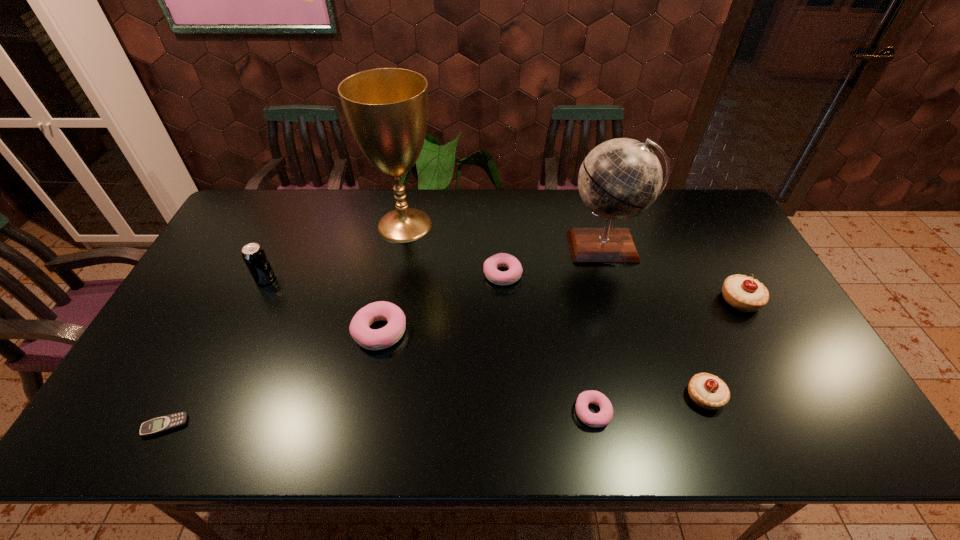
The image size is (960, 540). I want to click on the fifth object from right to left, so click(x=491, y=264).

Where is `the smallest pink pastry`? The height and width of the screenshot is (540, 960). the smallest pink pastry is located at coordinates (601, 419).

Where is `the shortest pastry`? the shortest pastry is located at coordinates (601, 419).

Find the location of a particular element. beeper is located at coordinates (166, 423).

Where is `gray beeper`? Image resolution: width=960 pixels, height=540 pixels. gray beeper is located at coordinates (166, 423).

You are a GUI agent. You are given a task and a screenshot of the screen. Output one action in this format:
    pyautogui.click(x=<x>, y=<y>)
    Task: Click on the vacant space positioned 0.330m on the right of the tallest object
    The width and height of the screenshot is (960, 540).
    Given the screenshot: What is the action you would take?
    pyautogui.click(x=536, y=225)

This screenshot has width=960, height=540. Find the location of `vacant space located at the equator of the eighth shortest object`. vacant space located at the equator of the eighth shortest object is located at coordinates (625, 315).

Identify the location of vacant position located 0.350m on the right of the soda can. (391, 279).

The height and width of the screenshot is (540, 960). In order to click on blank area located 0.210m on the left of the rightmost pastry in this screenshot , I will do `click(647, 300)`.

Locate an element on the screen. The width and height of the screenshot is (960, 540). free spot located 0.350m on the left of the fifth tallest object is located at coordinates (540, 396).